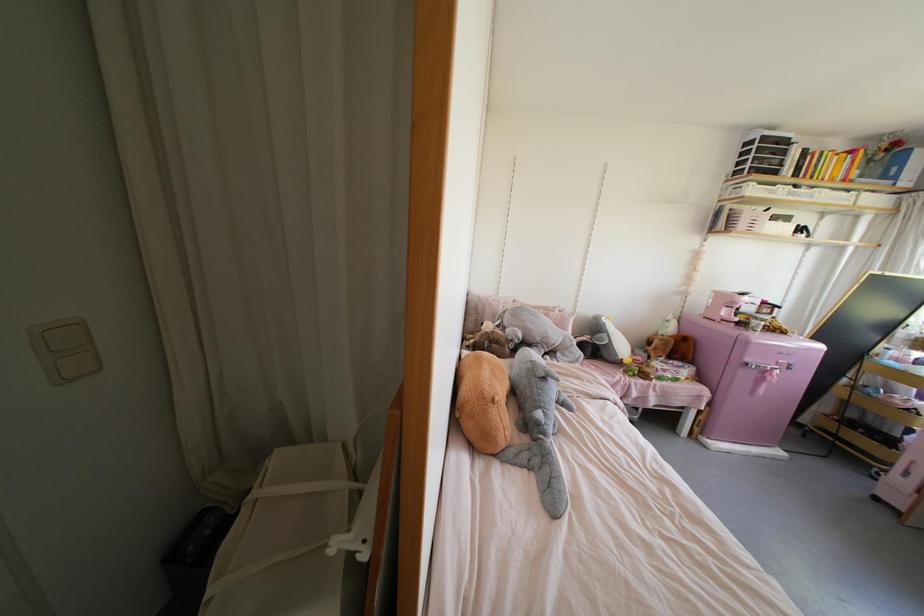
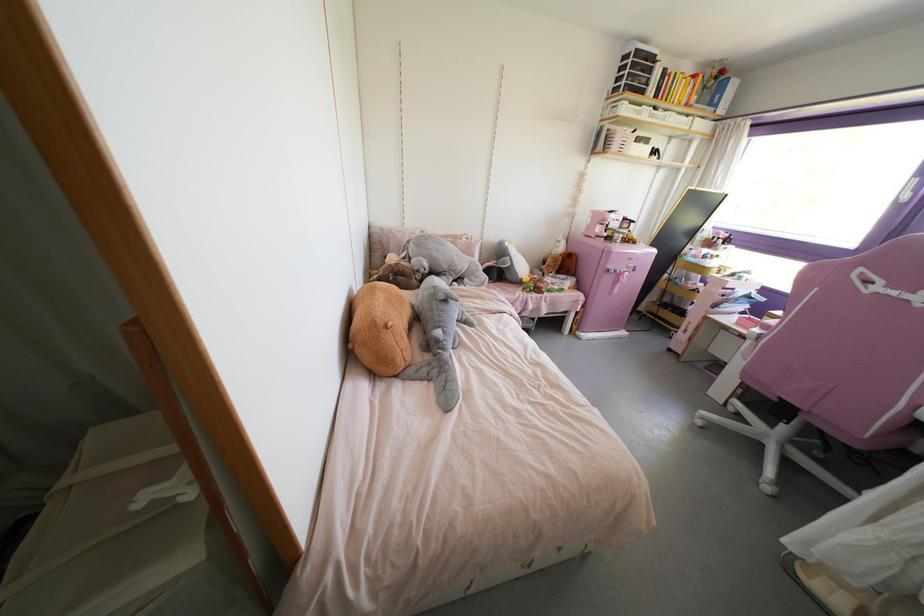
In the second image, find the point that corresponds to [786,368] in the first image.

(633, 270)